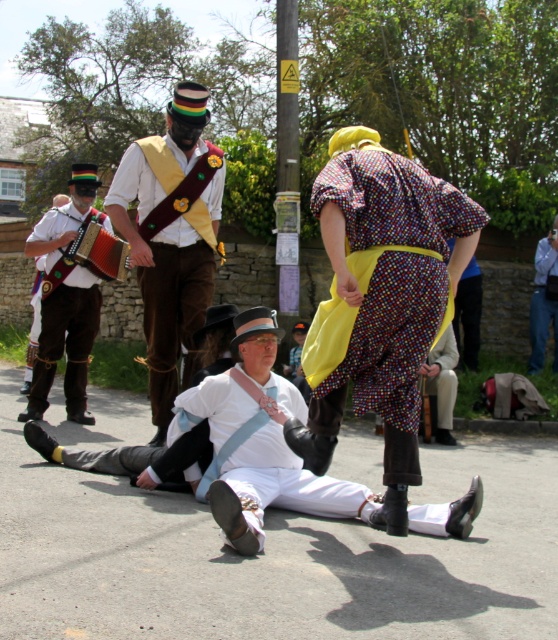
You are a photographer positioned in front of the scene. You want to capture a photo where both the leather brown pants at left and the wooden accordion at center are clearly visible. Based on their positions, which object should you focus on first to ensure both are in sharp focus?

Since the leather brown pants at left is closer to the viewer than the wooden accordion at center, you should focus on the leather brown pants at left first. This way, the depth of field will extend to the wooden accordion at center, keeping both in focus.